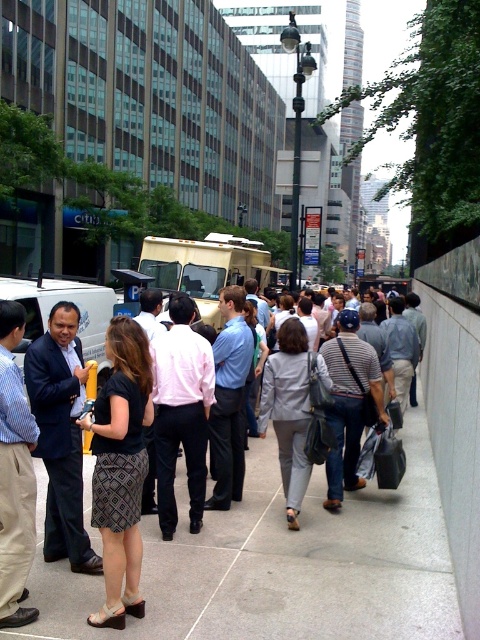
Which is above, gray concrete sidewalk at center or patterned fabric skirt at center?

patterned fabric skirt at center is above.

Does gray concrete sidewalk at center appear on the left side of patterned fabric skirt at center?

In fact, gray concrete sidewalk at center is to the right of patterned fabric skirt at center.

What do you see at coordinates (282, 564) in the screenshot?
I see `gray concrete sidewalk at center` at bounding box center [282, 564].

Find the location of a particular element. This screenshot has height=640, width=480. gray concrete sidewalk at center is located at coordinates (282, 564).

In the scene shown: Does gray fabric jacket at center have a greater width compared to beige plastic food truck at center?

No, gray fabric jacket at center is not wider than beige plastic food truck at center.

Is point (279, 401) behind point (244, 259)?

No, it is not.

Identify the location of gray fabric jacket at center. (288, 412).

Which is behind, point (183, 352) or point (156, 253)?

Positioned behind is point (156, 253).

Can you confirm if pink shirt at center is wider than beige plastic food truck at center?

No, pink shirt at center is not wider than beige plastic food truck at center.

Where is `pink shirt at center`? This screenshot has width=480, height=640. pink shirt at center is located at coordinates (180, 412).